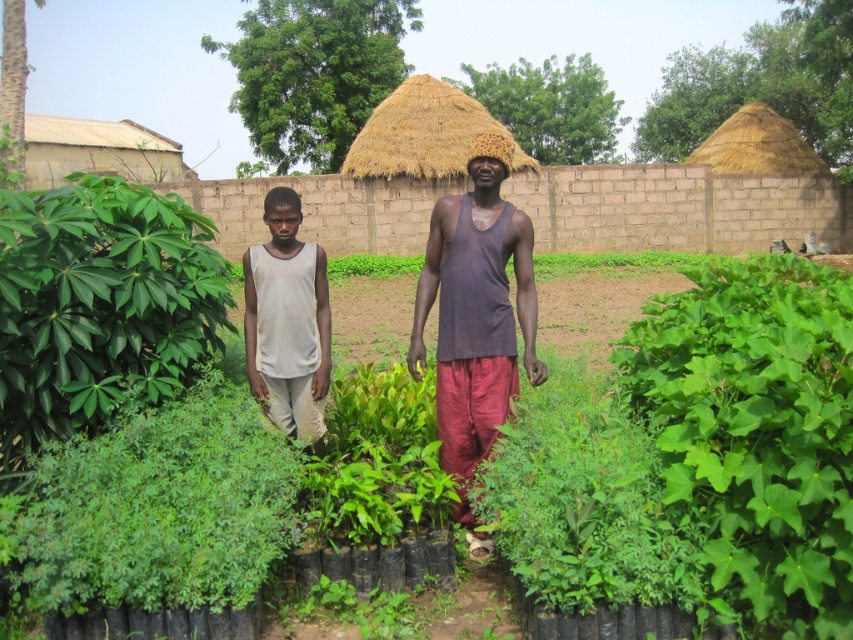
Question: Can you confirm if green leafy plant at left is wider than dark gray ribbed tank top at center?

Choices:
 (A) yes
 (B) no

Answer: (A)

Question: Does green leafy plants at center appear on the right side of green leafy plant at left?

Choices:
 (A) no
 (B) yes

Answer: (B)

Question: Which point is closer to the camera?

Choices:
 (A) green leafy plants at center
 (B) dark gray ribbed tank top at center

Answer: (A)

Question: Which of the following is the farthest from the observer?

Choices:
 (A) (292, 371)
 (B) (581, 496)
 (C) (488, 269)

Answer: (A)

Question: Which point is farther to the camera?

Choices:
 (A) gray matte tank top at center
 (B) green leafy plants at center
 (C) green leafy plant at left
 (D) matte brown tank top at center

Answer: (A)

Question: Does green leafy plants at center have a lesser width compared to gray matte tank top at center?

Choices:
 (A) no
 (B) yes

Answer: (A)